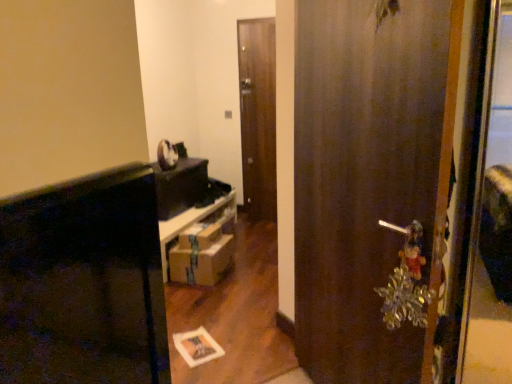
Question: Which direction should I rotate to look at wooden door at center, which appears as the 2th door when viewed from the left?

Choices:
 (A) left
 (B) right

Answer: (B)

Question: Can you confirm if wooden door at center, the second door viewed from the back, is wider than wooden door at center, which is the second door in front-to-back order?

Choices:
 (A) yes
 (B) no

Answer: (A)

Question: From the image's perspective, is wooden door at center, which is counted as the 1th door, starting from the front, on wooden door at center, which is the second door from right to left?

Choices:
 (A) no
 (B) yes

Answer: (A)

Question: From a real-world perspective, is wooden door at center, which is counted as the 1th door, starting from the front, under wooden door at center, which is the second door in front-to-back order?

Choices:
 (A) no
 (B) yes

Answer: (B)

Question: Is wooden door at center, the first door viewed from the right, bigger than wooden door at center, which ranks as the 1th door in back-to-front order?

Choices:
 (A) yes
 (B) no

Answer: (A)

Question: Is wooden door at center, the second door viewed from the back, positioned beyond the bounds of wooden door at center, which is the second door from right to left?

Choices:
 (A) yes
 (B) no

Answer: (A)

Question: Does wooden door at center, the first door viewed from the right, have a greater height compared to wooden door at center, which ranks as the 1th door in back-to-front order?

Choices:
 (A) no
 (B) yes

Answer: (A)

Question: Does wooden door at center, the first door viewed from the right, have a smaller size compared to brown cardboard boxes at center?

Choices:
 (A) yes
 (B) no

Answer: (B)

Question: Is wooden door at center, which appears as the 2th door when viewed from the left, with brown cardboard boxes at center?

Choices:
 (A) no
 (B) yes

Answer: (A)

Question: Considering the relative sizes of wooden door at center, which appears as the 2th door when viewed from the left, and brown cardboard boxes at center in the image provided, is wooden door at center, which appears as the 2th door when viewed from the left, wider than brown cardboard boxes at center?

Choices:
 (A) no
 (B) yes

Answer: (A)

Question: From a real-world perspective, is wooden door at center, which appears as the 2th door when viewed from the left, below brown cardboard boxes at center?

Choices:
 (A) yes
 (B) no

Answer: (B)

Question: Is the position of wooden door at center, which is counted as the 1th door, starting from the front, more distant than that of brown cardboard boxes at center?

Choices:
 (A) yes
 (B) no

Answer: (B)

Question: Is the depth of wooden door at center, which appears as the 2th door when viewed from the left, less than that of brown cardboard boxes at center?

Choices:
 (A) no
 (B) yes

Answer: (B)

Question: Is brown cardboard boxes at center looking in the opposite direction of brown cardboard drawer at center?

Choices:
 (A) no
 (B) yes

Answer: (A)